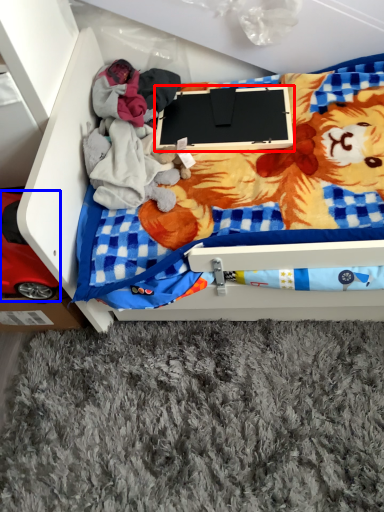
Question: Which object is closer to the camera taking this photo, laptop (highlighted by a red box) or toy (highlighted by a blue box)?

Choices:
 (A) laptop
 (B) toy

Answer: (B)